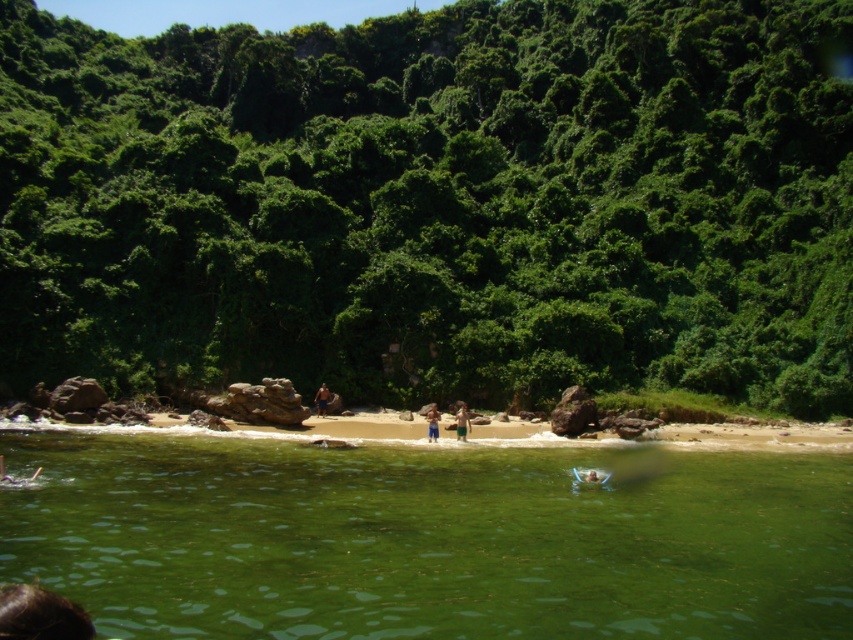
You are standing on the beach and want to walk towards both the point at coordinates (x=445, y=54) and the point at (x=438, y=412). Which point should you reach first?

You should reach the point at coordinates (x=445, y=54) first because it is closer to you than the point at (x=438, y=412).

You are standing on the beach and want to take a photo of the green leafy vegetation at center. If your camera has a maximum zoom range of 50 meters, will you be able to capture the vegetation clearly in your photo?

The green leafy vegetation at center and viewer are 43.88 meters apart from each other. Since the distance is within the camera maximum zoom range of 50 meters, you can capture the vegetation clearly.

You are a lifeguard observing two people at the beach. You notice their shorts are labeled as green shorts at center and brown textured shorts at center. Which pair of shorts is wider?

The green shorts at center might be wider than brown textured shorts at center.